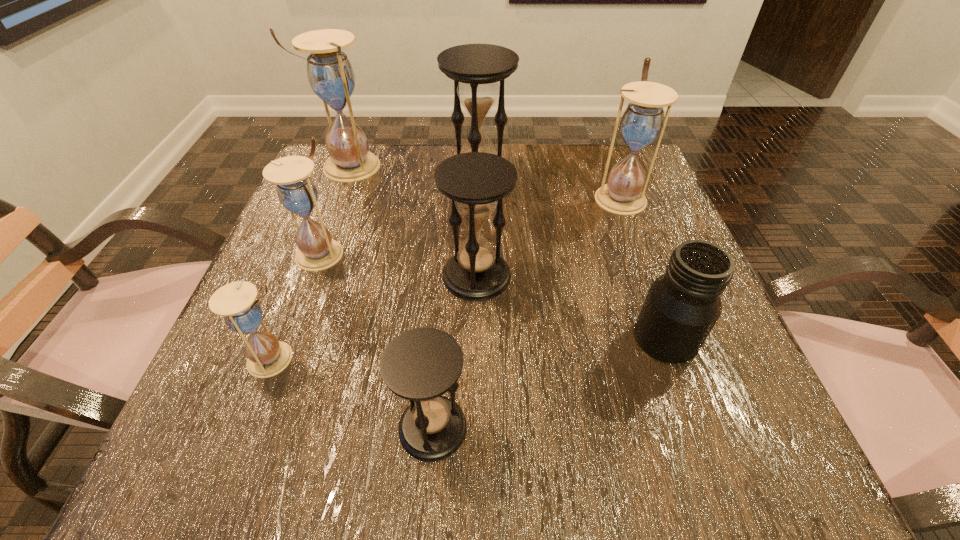
In order to click on the biggest white hourglass in this screenshot , I will do `click(330, 74)`.

I want to click on the tallest hourglass, so click(330, 74).

Identify the location of the farthest black hourglass. The height and width of the screenshot is (540, 960). (475, 68).

Locate an element on the screen. Image resolution: width=960 pixels, height=540 pixels. the second biggest white hourglass is located at coordinates (643, 120).

The height and width of the screenshot is (540, 960). Find the location of `the rightmost hourglass`. the rightmost hourglass is located at coordinates (643, 120).

Where is `the second biggest black hourglass`? The width and height of the screenshot is (960, 540). the second biggest black hourglass is located at coordinates (476, 182).

The image size is (960, 540). In order to click on the second nearest white hourglass in this screenshot , I will do `click(296, 191)`.

Find the location of `jar`. jar is located at coordinates (682, 306).

The image size is (960, 540). In order to click on the nearest white hourglass in this screenshot , I will do `click(267, 356)`.

Where is `the smallest white hourglass`? the smallest white hourglass is located at coordinates [x=267, y=356].